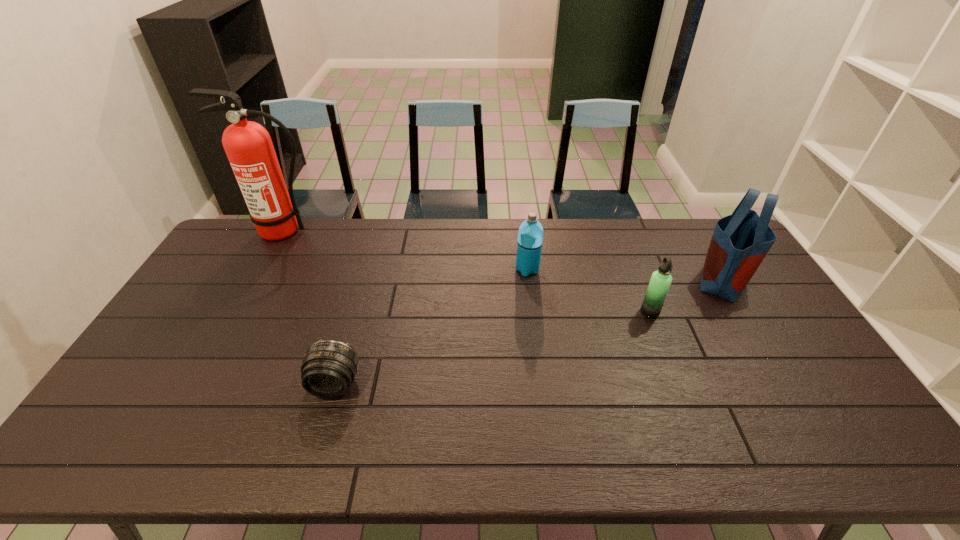
Locate an element on the screen. Image resolution: width=960 pixels, height=540 pixels. free space that satisfies the following two spatial constraints: 1. on the handle side of the tallest object; 2. on the left side of the farther thermos bottle is located at coordinates (263, 269).

Find the location of a particular element. Image resolution: width=960 pixels, height=540 pixels. free space that satisfies the following two spatial constraints: 1. on the front side of the nearer thermos bottle; 2. on the left side of the farther thermos bottle is located at coordinates (533, 312).